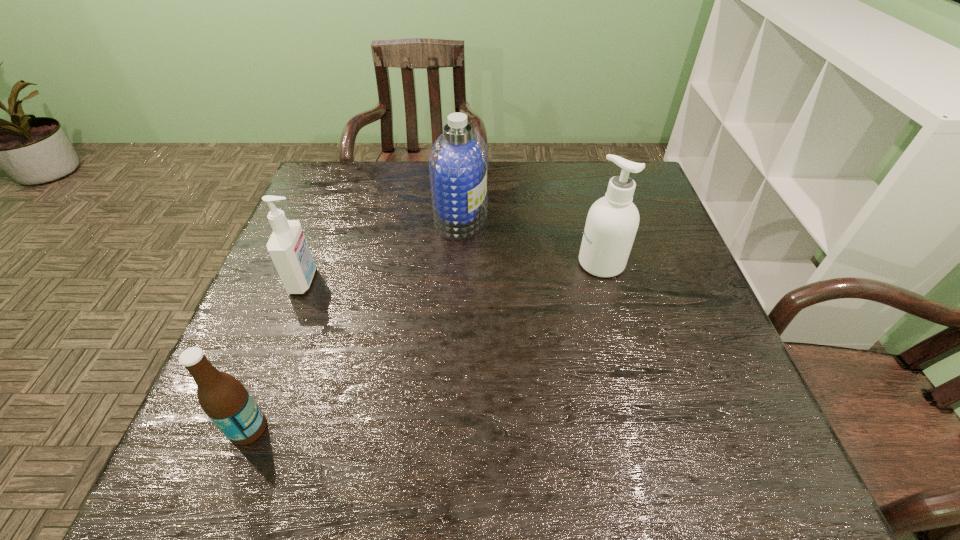
Locate an element on the screen. This screenshot has width=960, height=540. vacant area situated on the back of the beer bottle is located at coordinates (290, 320).

Identify the location of object that is at the far edge. The height and width of the screenshot is (540, 960). [458, 163].

The height and width of the screenshot is (540, 960). Find the location of `object located in the near edge section of the desktop`. object located in the near edge section of the desktop is located at coordinates (224, 399).

What are the coordinates of `cleansing agent that is positioned at the left edge` in the screenshot? It's located at (287, 246).

Locate an element on the screen. beer bottle located at the left edge is located at coordinates (224, 399).

I want to click on object that is at the right edge, so click(612, 222).

I want to click on object that is at the near left corner, so click(x=224, y=399).

At what (x,y) coordinates should I click in order to perform the action: click on vacant region at the far edge. Please return your answer as a coordinate pair (x, y). The width and height of the screenshot is (960, 540). Looking at the image, I should click on (414, 163).

What are the coordinates of `free region at the near edge of the desktop` in the screenshot? It's located at (461, 454).

What are the coordinates of `vacant space at the left edge` in the screenshot? It's located at (280, 404).